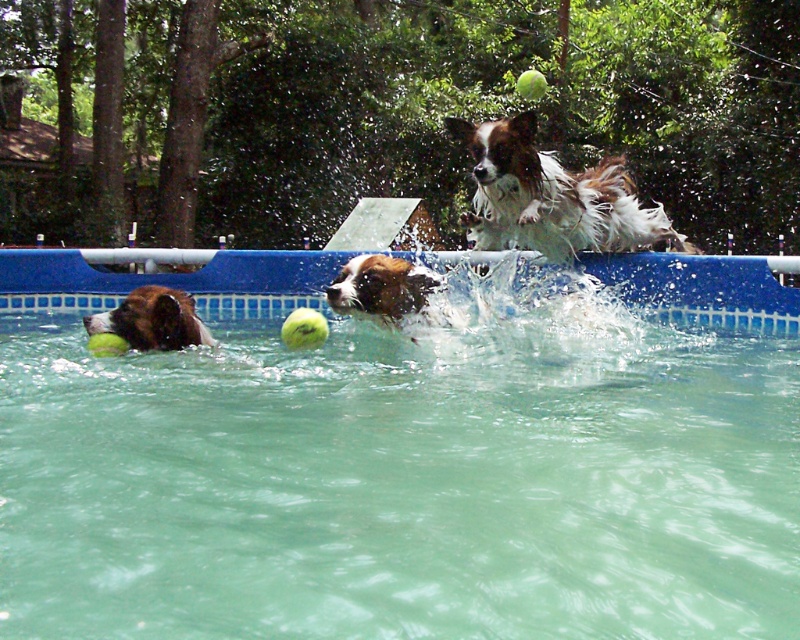
You are a photographer trying to capture a clear photo of both the white and brown fur dog at upper center and the white and brown fur dog at center. Since the dogs are in the water, you need to adjust your camera focus. Which dog should you focus on first to ensure it appears sharp in the photo?

You should focus on the white and brown fur dog at upper center first because it is closer to the camera than the white and brown fur dog at center, ensuring it will be in focus.

You are a photographer taking a picture of the two dogs in the pool. The white and brown fur dog at upper center and the brown and white fur dog at left are both in the frame. Based on their positions, which dog is closer to the camera?

The white and brown fur dog at upper center is closer to the camera because it is positioned over the brown and white fur dog at left.